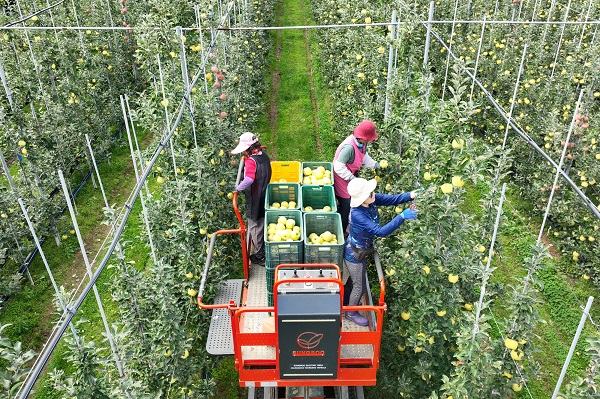
This screenshot has height=399, width=600. In order to click on baskets for food in this screenshot , I will do `click(269, 303)`, `click(269, 282)`, `click(273, 253)`, `click(327, 253)`, `click(323, 199)`, `click(276, 194)`, `click(320, 170)`, `click(283, 173)`.